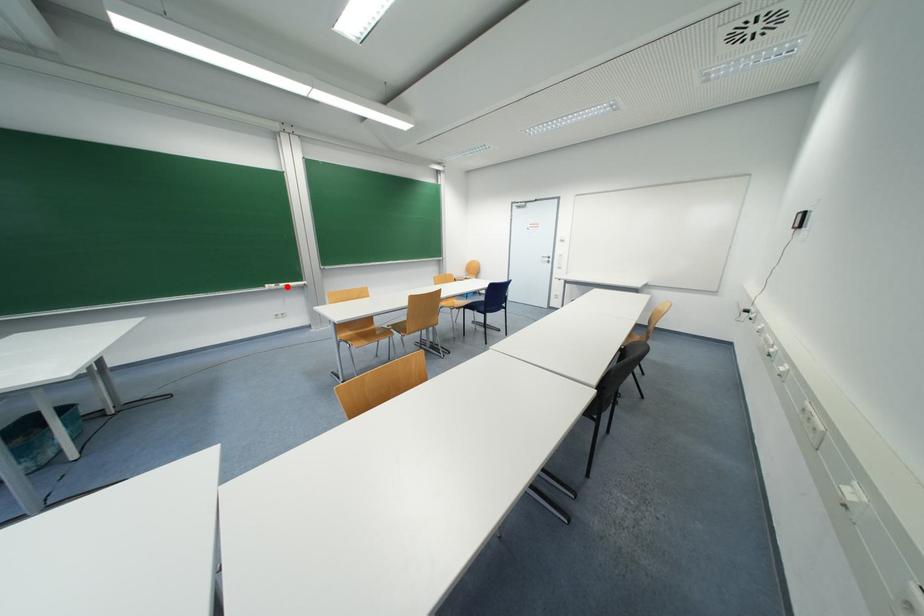
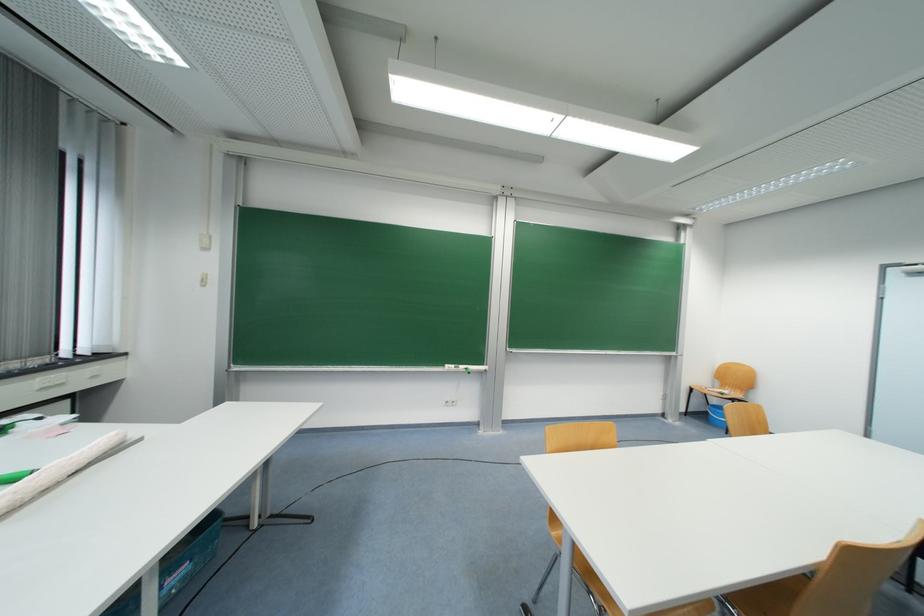
Question: I am providing you with two images of the same scene from different viewpoints. In image1, a red point is highlighted. Considering the same 3D point in image2, which of the following is correct?

Choices:
 (A) It is closer
 (B) It is farther

Answer: (B)